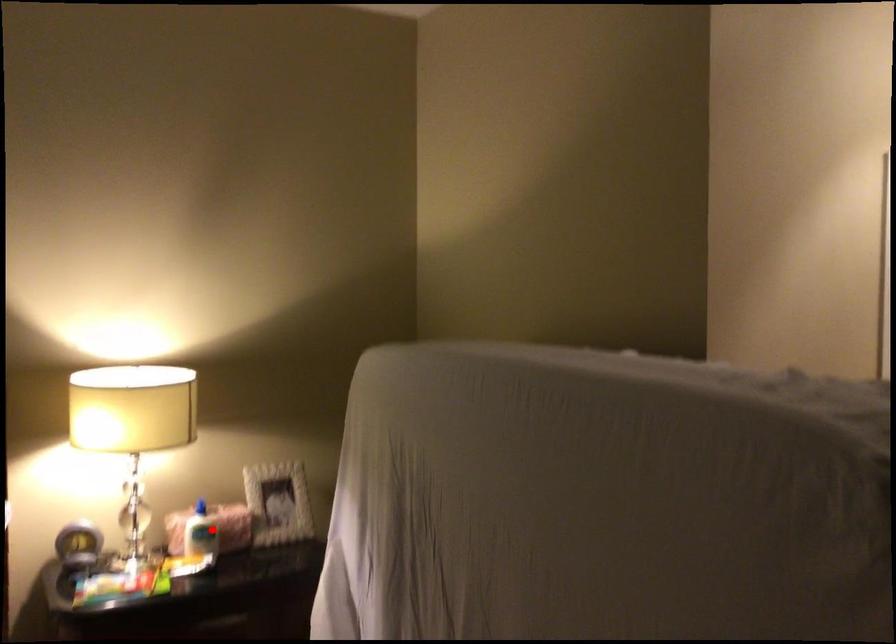
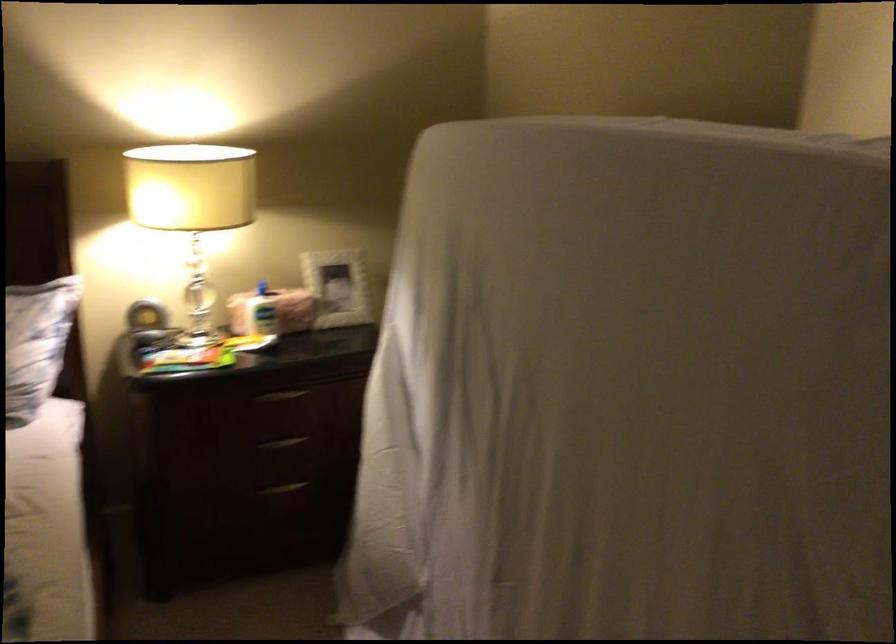
Question: I am providing you with two images of the same scene from different viewpoints. A red point is marked on the first image. Is the red point's position out of view in image 2?

Choices:
 (A) Yes
 (B) No

Answer: (B)